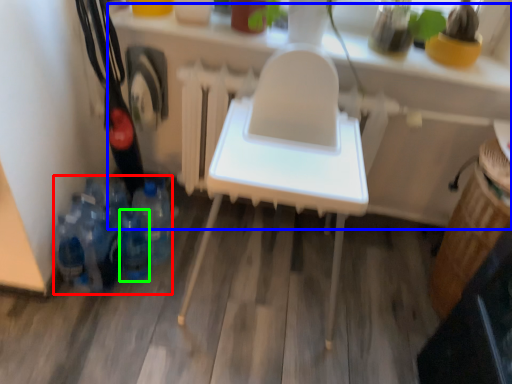
Question: Considering the real-world distances, which object is closest to bottle (highlighted by a red box)? table (highlighted by a blue box) or bottle (highlighted by a green box).

Choices:
 (A) table
 (B) bottle

Answer: (B)